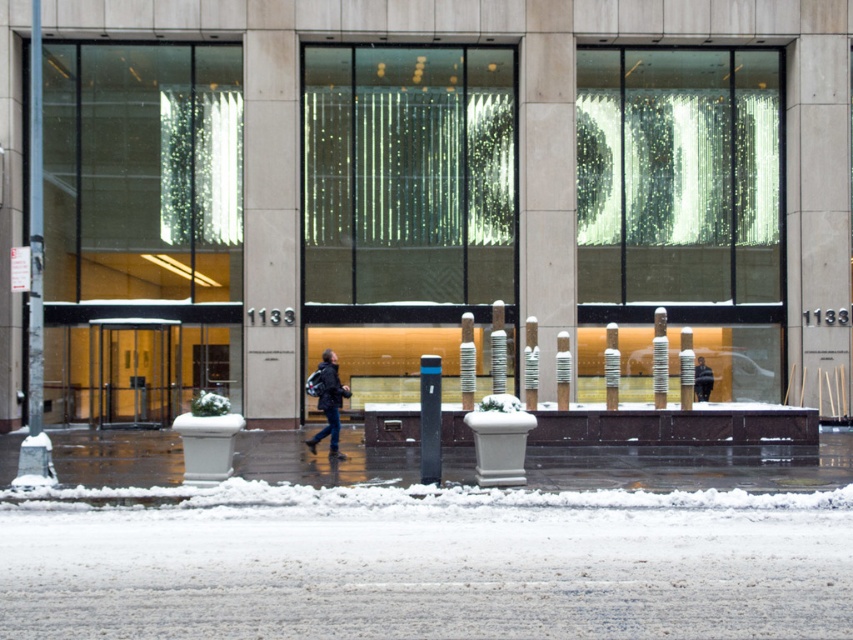
Question: Which object appears closest to the camera in this image?

Choices:
 (A) dark blue jeans at center
 (B) white snow at lower center

Answer: (B)

Question: Can you confirm if white snow at lower center is positioned to the right of dark blue jeans at center?

Choices:
 (A) yes
 (B) no

Answer: (A)

Question: Does dark blue jeans at center have a smaller size compared to dark gray jacket at center?

Choices:
 (A) no
 (B) yes

Answer: (B)

Question: Is dark blue jeans at center smaller than dark gray jacket at center?

Choices:
 (A) no
 (B) yes

Answer: (B)

Question: Which of the following is the closest to the observer?

Choices:
 (A) (712, 378)
 (B) (323, 390)
 (C) (370, 592)

Answer: (C)

Question: Which object is farther from the camera taking this photo?

Choices:
 (A) dark gray jacket at center
 (B) white snow at lower center
 (C) dark blue jeans at center

Answer: (A)